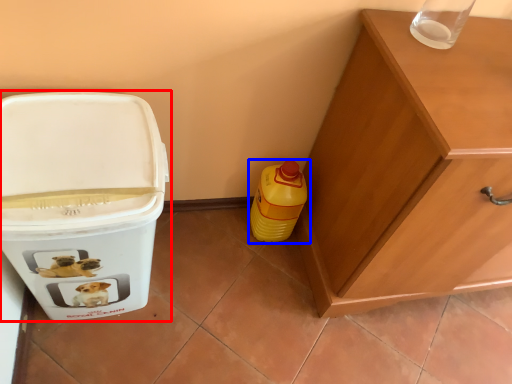
Question: Which of the following is the farthest to the observer, waste container (highlighted by a red box) or bottle (highlighted by a blue box)?

Choices:
 (A) waste container
 (B) bottle

Answer: (B)